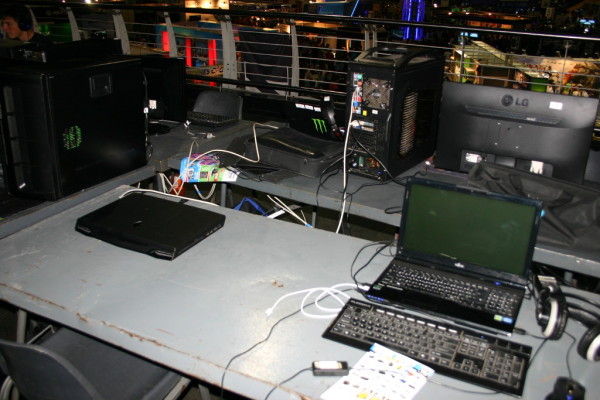
The height and width of the screenshot is (400, 600). Identify the location of laptop scree. (464, 227).